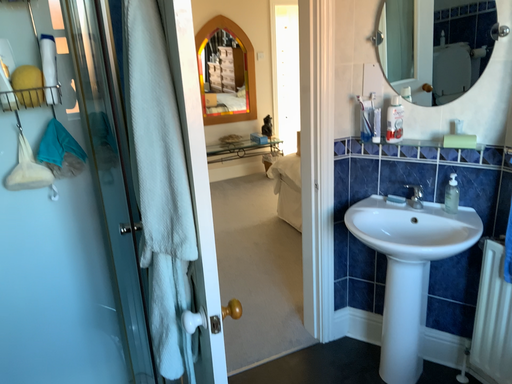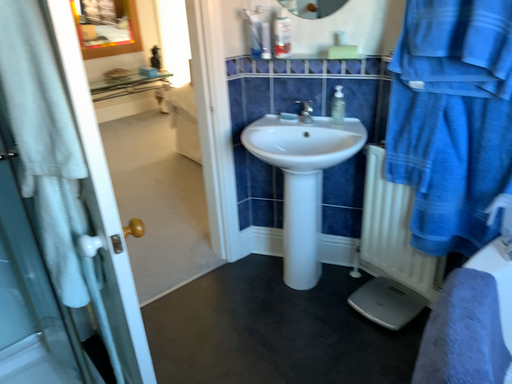
Question: How did the camera likely rotate when shooting the video?

Choices:
 (A) rotated upward
 (B) rotated downward

Answer: (B)